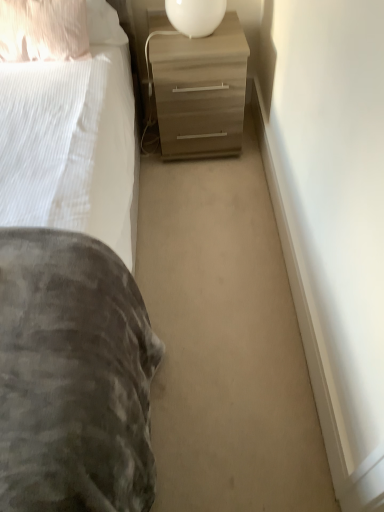
I want to click on vacant space to the right of white glossy table lamp at upper center, so click(231, 30).